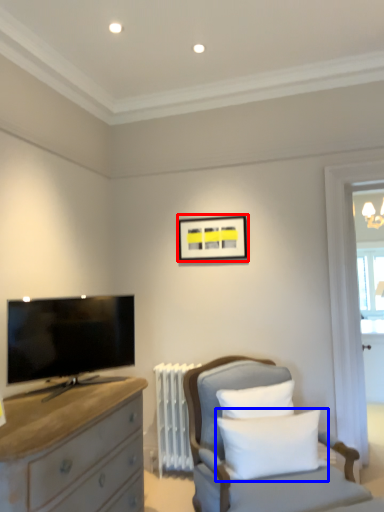
Question: Which of the following is the farthest to the observer, picture frame (highlighted by a red box) or pillow (highlighted by a blue box)?

Choices:
 (A) picture frame
 (B) pillow

Answer: (A)